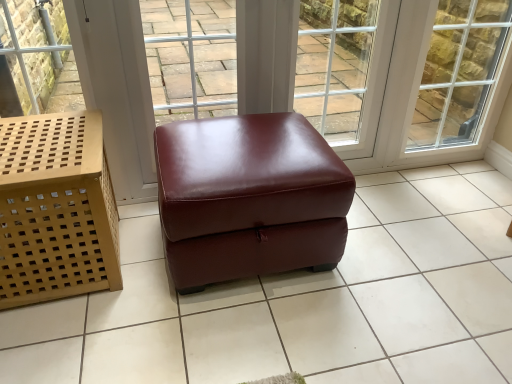
Identify the location of free space in front of light brown woven basket at left. (69, 339).